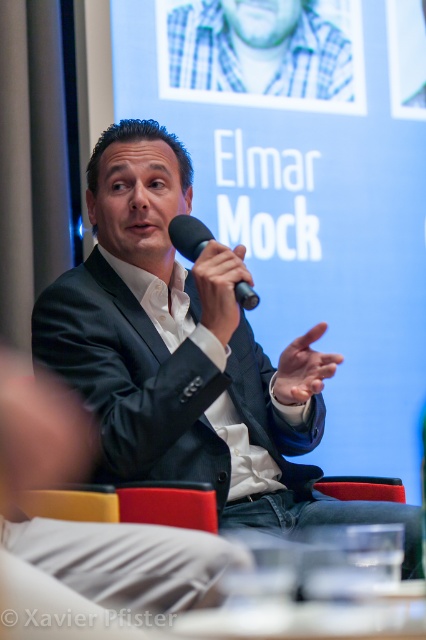
Question: Which point is closer to the camera?

Choices:
 (A) (273, 4)
 (B) (238, 332)

Answer: (B)

Question: Can you confirm if blue plaid shirt at upper center is positioned above black matte microphone at upper center?

Choices:
 (A) yes
 (B) no

Answer: (A)

Question: Is blue plaid shirt at upper center thinner than black matte microphone at upper center?

Choices:
 (A) yes
 (B) no

Answer: (B)

Question: Which object is closer to the camera taking this photo?

Choices:
 (A) black suit at center
 (B) black matte microphone at upper center

Answer: (A)

Question: Which point is closer to the camera taking this photo?

Choices:
 (A) (296, 432)
 (B) (173, 65)

Answer: (A)

Question: Is blue plaid shirt at upper center wider than black matte microphone at upper center?

Choices:
 (A) yes
 (B) no

Answer: (A)